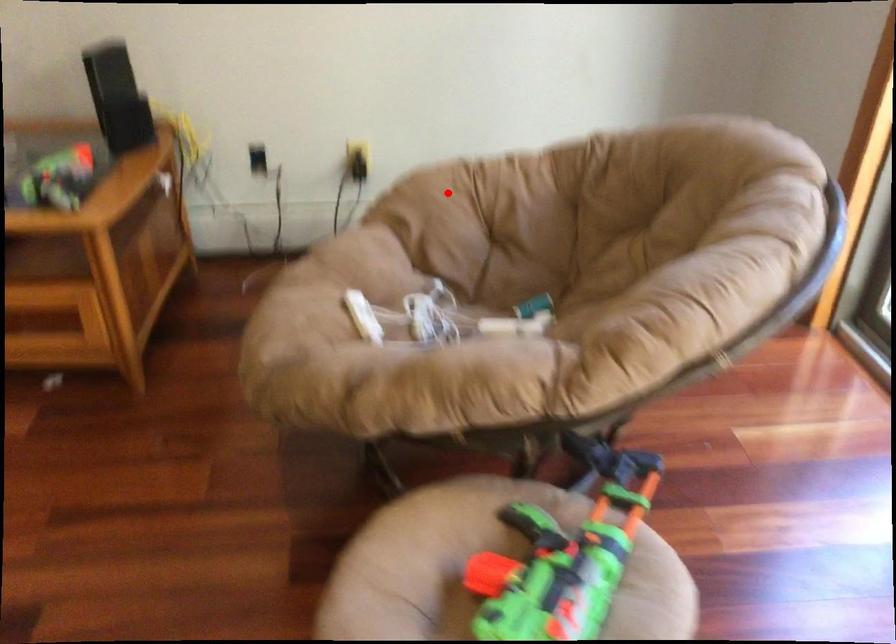
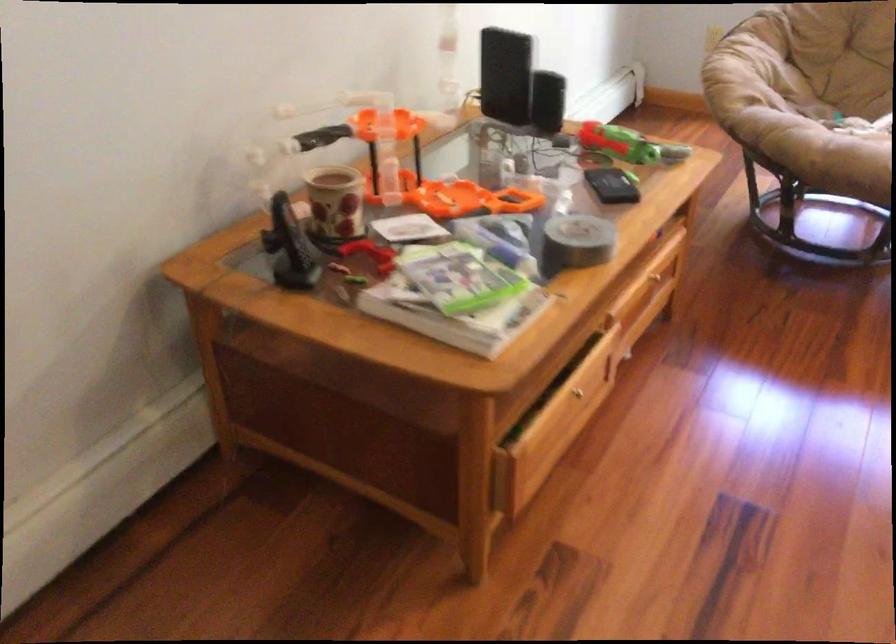
Where in the second image is the point corresponding to the highlighted location from the first image?

(745, 69)